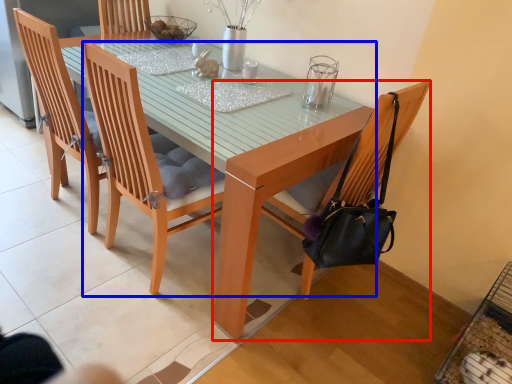
Question: Which of the following is the closest to the observer, chair (highlighted by a red box) or chair (highlighted by a blue box)?

Choices:
 (A) chair
 (B) chair

Answer: (B)